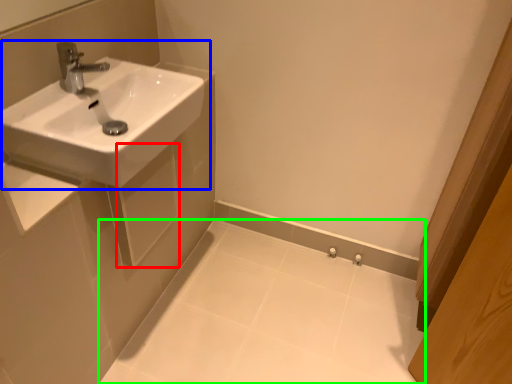
Question: Estimate the real-world distances between objects in this image. Which object is closer to square (highlighted by a red box), sink (highlighted by a blue box) or porcelain (highlighted by a green box)?

Choices:
 (A) sink
 (B) porcelain

Answer: (A)